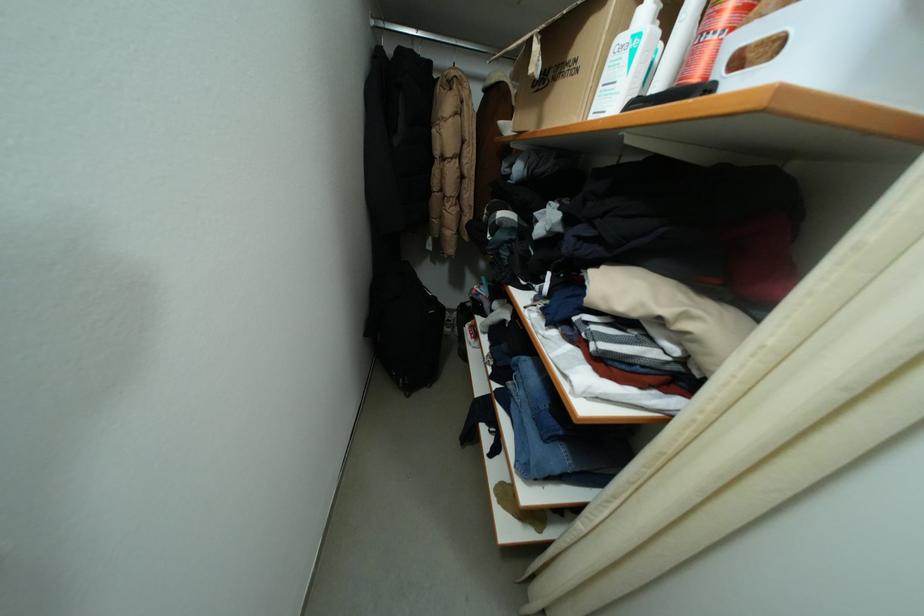
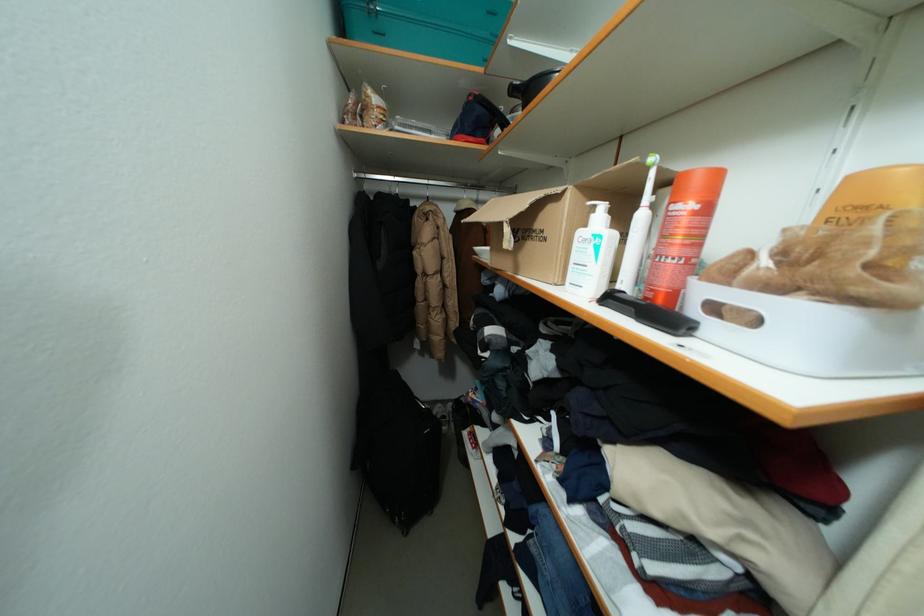
Find the pixel in the second image that matches the point at 626,43 in the first image.

(589, 236)